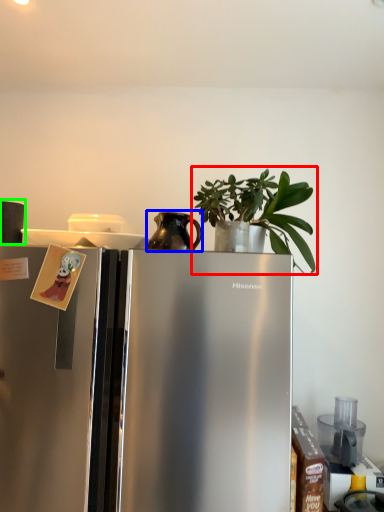
Question: Considering the real-world distances, which object is closest to houseplant (highlighted by a red box)? appliance (highlighted by a blue box) or appliance (highlighted by a green box).

Choices:
 (A) appliance
 (B) appliance

Answer: (A)